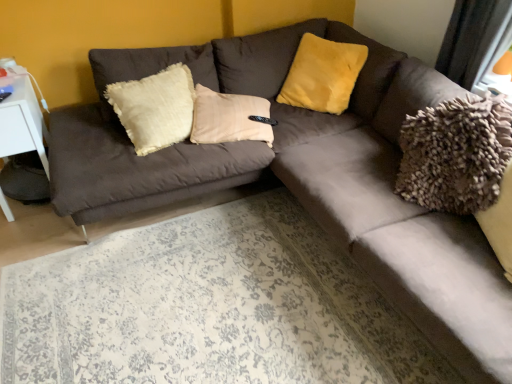
Question: In terms of size, does yellow fuzzy pillow at upper center appear bigger or smaller than white plastic table at left?

Choices:
 (A) small
 (B) big

Answer: (A)

Question: Is yellow fuzzy pillow at upper center in front of or behind white plastic table at left in the image?

Choices:
 (A) behind
 (B) front

Answer: (A)

Question: From a real-world perspective, is yellow fuzzy pillow at upper center physically located above or below white plastic table at left?

Choices:
 (A) below
 (B) above

Answer: (B)

Question: Is point (45, 165) positioned closer to the camera than point (324, 41)?

Choices:
 (A) closer
 (B) farther

Answer: (A)

Question: In the image, is white plastic table at left on the left side or the right side of yellow fuzzy pillow at upper center?

Choices:
 (A) left
 (B) right

Answer: (A)

Question: In the image, is white plastic table at left positioned in front of or behind yellow fuzzy pillow at upper center?

Choices:
 (A) behind
 (B) front

Answer: (B)

Question: From the image's perspective, relative to yellow fuzzy pillow at upper center, is white plastic table at left above or below?

Choices:
 (A) below
 (B) above

Answer: (A)